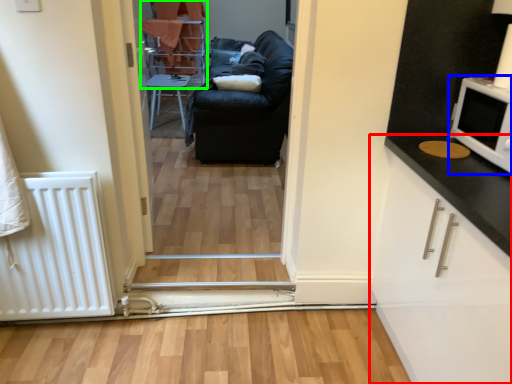
Question: Considering the real-world distances, which object is closest to cabinetry (highlighted by a red box)? appliance (highlighted by a blue box) or bunk bed (highlighted by a green box).

Choices:
 (A) appliance
 (B) bunk bed

Answer: (A)